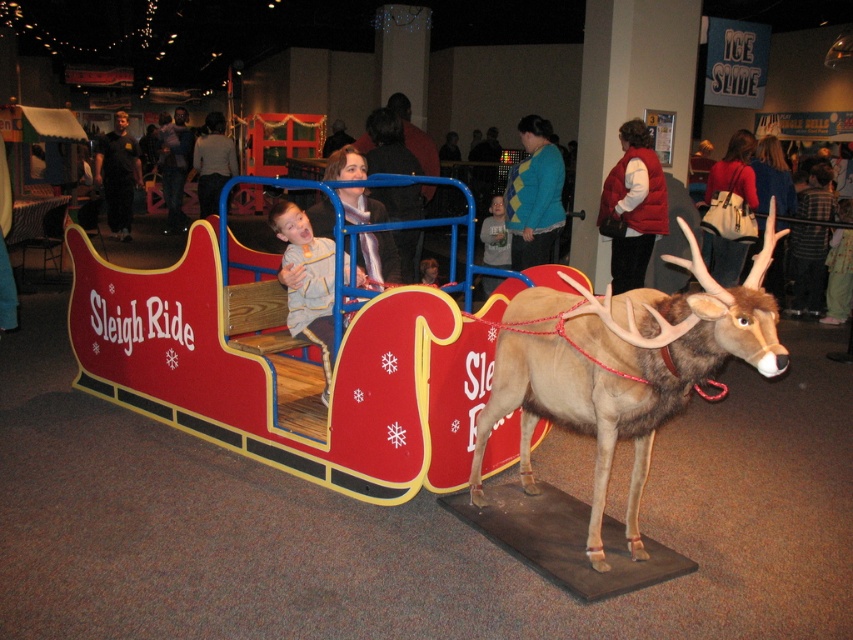
Question: Where is leather handbag at upper right located in relation to dark blue jeans at center in the image?

Choices:
 (A) right
 (B) left

Answer: (A)

Question: Which point is farther from the camera taking this photo?

Choices:
 (A) (730, 154)
 (B) (383, 244)
 (C) (618, 204)
 (D) (129, 163)

Answer: (D)

Question: Does red fleece vest at upper right appear on the left side of dark blue jeans at center?

Choices:
 (A) yes
 (B) no

Answer: (B)

Question: Which point is closer to the camera?

Choices:
 (A) dark blue shirt at left
 (B) teal sweater at center
 (C) light gray sweater at center
 (D) brown fur reindeer at center

Answer: (D)

Question: Among these points, which one is farthest from the camera?

Choices:
 (A) (611, 196)
 (B) (115, 228)
 (C) (672, 332)

Answer: (B)

Question: Can you confirm if red fleece vest at upper right is wider than leather handbag at upper right?

Choices:
 (A) no
 (B) yes

Answer: (B)